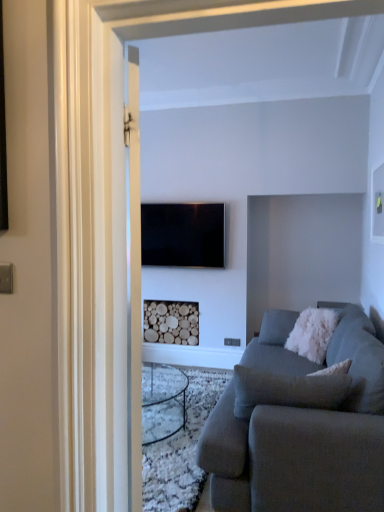
Question: Choose the correct answer: Is white fluffy pillow at right inside wooden logs at center or outside it?

Choices:
 (A) inside
 (B) outside

Answer: (B)

Question: Is white fluffy pillow at right wider or thinner than wooden logs at center?

Choices:
 (A) thin
 (B) wide

Answer: (B)

Question: Which is nearer to the flat screen tv at center?

Choices:
 (A) wooden logs at center
 (B) gray fabric couch at lower right
 (C) white fluffy pillow at right

Answer: (A)

Question: Estimate the real-world distances between objects in this image. Which object is farther from the flat screen tv at center?

Choices:
 (A) white fluffy pillow at right
 (B) wooden logs at center
 (C) gray fabric couch at lower right

Answer: (C)